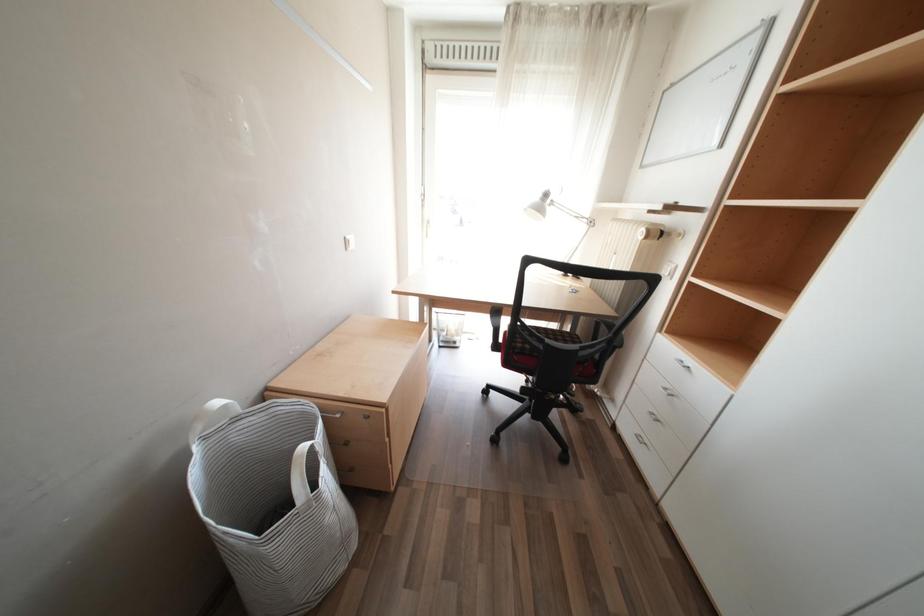
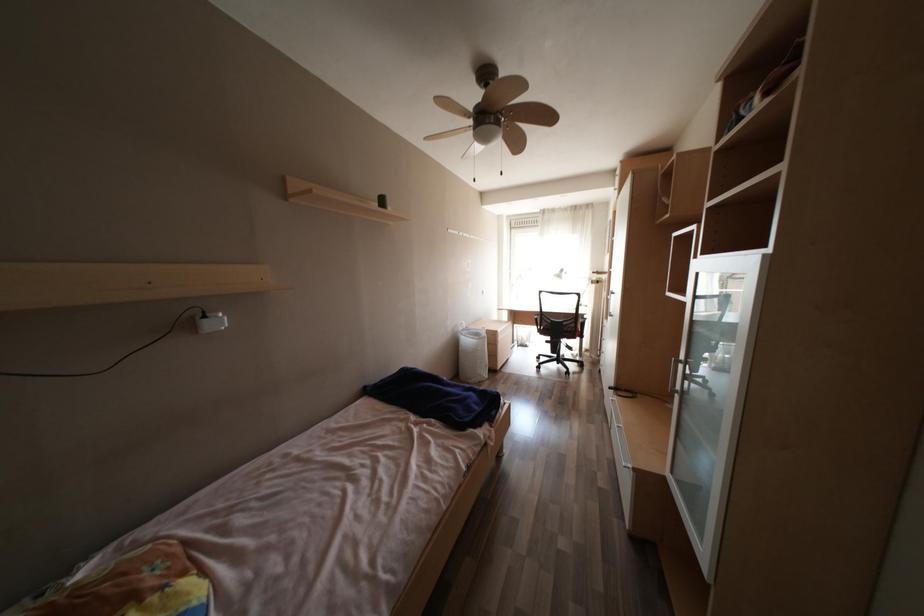
Question: The images are taken continuously from a first-person perspective. In which direction are you moving?

Choices:
 (A) Left
 (B) Right
 (C) Forward
 (D) Backward

Answer: (D)